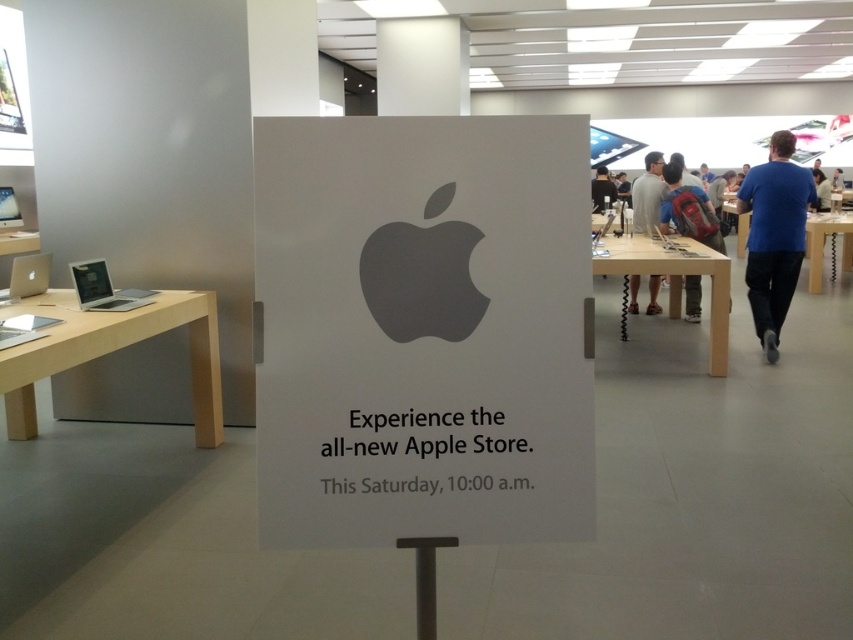
What do you see at coordinates (422, 330) in the screenshot?
I see `white paper sign at center` at bounding box center [422, 330].

Is white paper sign at center to the left of silver metallic laptop at left from the viewer's perspective?

In fact, white paper sign at center is to the right of silver metallic laptop at left.

Image resolution: width=853 pixels, height=640 pixels. I want to click on white paper sign at center, so pos(422,330).

Can you confirm if blue cotton shirt at right is bigger than blue fabric shirt at center?

Yes.

Does blue cotton shirt at right appear over blue fabric shirt at center?

No.

Is point (767, 326) positioned after point (815, 186)?

Yes, it is.

Image resolution: width=853 pixels, height=640 pixels. Identify the location of blue cotton shirt at right. (775, 236).

In the scene shown: Does red backpack at center appear on the left side of sleek silver laptop at left?

In fact, red backpack at center is to the right of sleek silver laptop at left.

Does point (700, 212) come closer to viewer compared to point (68, 266)?

No, (700, 212) is behind (68, 266).

At what (x,y) coordinates should I click in order to perform the action: click on red backpack at center. Please return your answer as a coordinate pair (x, y). This screenshot has width=853, height=640. Looking at the image, I should click on point(688,209).